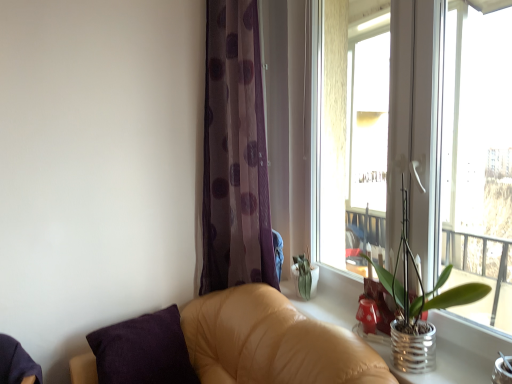
Question: Considering the relative sizes of translucent purple curtain at center and purple cotton pillow at lower left in the image provided, is translucent purple curtain at center taller than purple cotton pillow at lower left?

Choices:
 (A) yes
 (B) no

Answer: (A)

Question: Is translucent purple curtain at center with purple cotton pillow at lower left?

Choices:
 (A) yes
 (B) no

Answer: (B)

Question: From a real-world perspective, does translucent purple curtain at center stand above purple cotton pillow at lower left?

Choices:
 (A) no
 (B) yes

Answer: (B)

Question: Considering the relative sizes of translucent purple curtain at center and purple cotton pillow at lower left in the image provided, is translucent purple curtain at center thinner than purple cotton pillow at lower left?

Choices:
 (A) yes
 (B) no

Answer: (A)

Question: Is translucent purple curtain at center shorter than purple cotton pillow at lower left?

Choices:
 (A) no
 (B) yes

Answer: (A)

Question: In the image, is metallic silver pot at right positioned in front of or behind purple cotton pillow at lower left?

Choices:
 (A) front
 (B) behind

Answer: (A)

Question: Choose the correct answer: Is metallic silver pot at right inside purple cotton pillow at lower left or outside it?

Choices:
 (A) inside
 (B) outside

Answer: (B)

Question: Considering the relative positions of metallic silver pot at right and purple cotton pillow at lower left in the image provided, is metallic silver pot at right to the left or to the right of purple cotton pillow at lower left?

Choices:
 (A) left
 (B) right

Answer: (B)

Question: Considering the positions of metallic silver pot at right and purple cotton pillow at lower left in the image, is metallic silver pot at right taller or shorter than purple cotton pillow at lower left?

Choices:
 (A) tall
 (B) short

Answer: (A)

Question: Which is correct: tan leather couch at lower right is inside transparent glass window at upper right, or outside of it?

Choices:
 (A) inside
 (B) outside

Answer: (B)

Question: Considering their positions, is tan leather couch at lower right located in front of or behind transparent glass window at upper right?

Choices:
 (A) behind
 (B) front

Answer: (B)

Question: Visually, is tan leather couch at lower right positioned to the left or to the right of transparent glass window at upper right?

Choices:
 (A) left
 (B) right

Answer: (A)

Question: Considering the positions of tan leather couch at lower right and transparent glass window at upper right in the image, is tan leather couch at lower right bigger or smaller than transparent glass window at upper right?

Choices:
 (A) big
 (B) small

Answer: (A)

Question: Which is correct: silver metallic pot at right is inside tan leather couch at lower right, or outside of it?

Choices:
 (A) inside
 (B) outside

Answer: (B)

Question: In terms of height, does silver metallic pot at right look taller or shorter compared to tan leather couch at lower right?

Choices:
 (A) tall
 (B) short

Answer: (B)